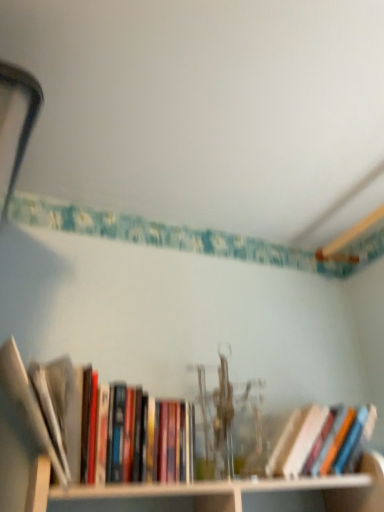
You are a GUI agent. You are given a task and a screenshot of the screen. Output one action in this format:
    pyautogui.click(x=<x>, y=<y>)
    Task: Click on the white wood cabinet at lower center
    
    Given the screenshot: What is the action you would take?
    pyautogui.click(x=235, y=494)

What do you see at coordinates (235, 494) in the screenshot? The height and width of the screenshot is (512, 384). I see `white wood cabinet at lower center` at bounding box center [235, 494].

Measure the distance between hardcover books at left, which ranks as the 1th book in left-to-right order, and camera.

hardcover books at left, which ranks as the 1th book in left-to-right order, is 77.92 centimeters from camera.

At what (x,y) coordinates should I click in order to perform the action: click on hardcover book at center, positioned as the first book in right-to-left order. Please return your answer as a coordinate pair (x, y). Looking at the image, I should click on (308, 439).

Looking at their sizes, would you say hardcover books at left, which ranks as the 1th book in left-to-right order, is wider or thinner than white wood cabinet at lower center?

Considering their sizes, hardcover books at left, which ranks as the 1th book in left-to-right order, looks broader than white wood cabinet at lower center.

Is hardcover books at left, which ranks as the 1th book in left-to-right order, to the left or to the right of white wood cabinet at lower center in the image?

In the image, hardcover books at left, which ranks as the 1th book in left-to-right order, appears on the left side of white wood cabinet at lower center.

Is hardcover books at left, the 2th book from the right, touching white wood cabinet at lower center?

No, hardcover books at left, the 2th book from the right, is not in contact with white wood cabinet at lower center.

Considering the points (115, 464) and (288, 480), which point is in front, point (115, 464) or point (288, 480)?

Positioned in front is point (115, 464).

Is white wood cabinet at lower center completely or partially outside of hardcover books at left, the 2th book from the right?

Absolutely, white wood cabinet at lower center is external to hardcover books at left, the 2th book from the right.

Could you measure the distance between white wood cabinet at lower center and hardcover books at left, the 2th book from the right?

They are 4.55 inches apart.

Is white wood cabinet at lower center closer to the viewer compared to hardcover books at left, the 2th book from the right?

No, it is not.

From a real-world perspective, is white wood cabinet at lower center positioned over hardcover books at left, the 2th book from the right, based on gravity?

No, from a real-world perspective, white wood cabinet at lower center is not above hardcover books at left, the 2th book from the right.

From the picture: Is hardcover book at center, the 2th book positioned from the left, in front of or behind white wood cabinet at lower center in the image?

Clearly, hardcover book at center, the 2th book positioned from the left, is behind white wood cabinet at lower center.

Does hardcover book at center, positioned as the first book in right-to-left order, appear on the left side of white wood cabinet at lower center?

No.

Is hardcover book at center, positioned as the first book in right-to-left order, looking in the opposite direction of white wood cabinet at lower center?

No, hardcover book at center, positioned as the first book in right-to-left order, is not facing the opposite direction of white wood cabinet at lower center.

Based on the photo, between hardcover book at center, the 2th book positioned from the left, and white wood cabinet at lower center, which one has less height?

white wood cabinet at lower center.

How many degrees apart are the facing directions of white wood cabinet at lower center and hardcover book at center, the 2th book positioned from the left?

The angle between the facing direction of white wood cabinet at lower center and the facing direction of hardcover book at center, the 2th book positioned from the left, is 0.822 degrees.

From the picture: Is white wood cabinet at lower center spatially inside hardcover book at center, positioned as the first book in right-to-left order, or outside of it?

white wood cabinet at lower center lies outside hardcover book at center, positioned as the first book in right-to-left order.

Does white wood cabinet at lower center have a smaller size compared to hardcover book at center, positioned as the first book in right-to-left order?

No, white wood cabinet at lower center is not smaller than hardcover book at center, positioned as the first book in right-to-left order.

Is hardcover book at center, positioned as the first book in right-to-left order, inside or outside of hardcover books at left, which ranks as the 1th book in left-to-right order?

hardcover book at center, positioned as the first book in right-to-left order, exists outside the volume of hardcover books at left, which ranks as the 1th book in left-to-right order.

Based on the photo, is hardcover book at center, the 2th book positioned from the left, in front of or behind hardcover books at left, the 2th book from the right, in the image?

Visually, hardcover book at center, the 2th book positioned from the left, is located behind hardcover books at left, the 2th book from the right.

From the image's perspective, between hardcover book at center, the 2th book positioned from the left, and hardcover books at left, which ranks as the 1th book in left-to-right order, who is located below?

hardcover book at center, the 2th book positioned from the left, is shown below in the image.

Can you tell me how much hardcover book at center, the 2th book positioned from the left, and hardcover books at left, the 2th book from the right, differ in facing direction?

0.000753 degrees.

From a real-world perspective, is hardcover books at left, which ranks as the 1th book in left-to-right order, beneath hardcover book at center, the 2th book positioned from the left?

No, from a real-world perspective, hardcover books at left, which ranks as the 1th book in left-to-right order, is not beneath hardcover book at center, the 2th book positioned from the left.

Could you tell me if hardcover books at left, the 2th book from the right, is turned towards hardcover book at center, positioned as the first book in right-to-left order?

No.

Can we say hardcover books at left, which ranks as the 1th book in left-to-right order, lies outside hardcover book at center, the 2th book positioned from the left?

hardcover books at left, which ranks as the 1th book in left-to-right order, is positioned outside hardcover book at center, the 2th book positioned from the left.

Locate an element on the screen. The width and height of the screenshot is (384, 512). book behind the hardcover books at left, the 2th book from the right is located at coordinates (308, 439).

You are a GUI agent. You are given a task and a screenshot of the screen. Output one action in this format:
    pyautogui.click(x=<x>, y=<y>)
    Task: Click on the cabinet located on the right of hardcover books at left, which ranks as the 1th book in left-to-right order
    
    Given the screenshot: What is the action you would take?
    (235, 494)

The image size is (384, 512). I want to click on book that is the 2nd one above the white wood cabinet at lower center (from a real-world perspective), so click(x=140, y=437).

From the image, which object appears to be farther from white wood cabinet at lower center, hardcover book at center, the 2th book positioned from the left, or hardcover books at left, the 2th book from the right?

hardcover book at center, the 2th book positioned from the left, is further to white wood cabinet at lower center.

Looking at the image, which one is located further to white wood cabinet at lower center, hardcover books at left, the 2th book from the right, or hardcover book at center, positioned as the first book in right-to-left order?

hardcover book at center, positioned as the first book in right-to-left order, is further to white wood cabinet at lower center.

Estimate the real-world distances between objects in this image. Which object is further from hardcover book at center, positioned as the first book in right-to-left order, hardcover books at left, the 2th book from the right, or white wood cabinet at lower center?

The object further to hardcover book at center, positioned as the first book in right-to-left order, is hardcover books at left, the 2th book from the right.

Consider the image. Considering their positions, is white wood cabinet at lower center positioned further to hardcover book at center, the 2th book positioned from the left, than hardcover books at left, the 2th book from the right?

hardcover books at left, the 2th book from the right, lies further to hardcover book at center, the 2th book positioned from the left, than the other object.

From the image, which object appears to be nearer to hardcover books at left, which ranks as the 1th book in left-to-right order, white wood cabinet at lower center or hardcover book at center, the 2th book positioned from the left?

white wood cabinet at lower center is closer to hardcover books at left, which ranks as the 1th book in left-to-right order.

Estimate the real-world distances between objects in this image. Which object is closer to hardcover books at left, the 2th book from the right, hardcover book at center, positioned as the first book in right-to-left order, or white wood cabinet at lower center?

white wood cabinet at lower center.

Locate an element on the screen. The width and height of the screenshot is (384, 512). cabinet between hardcover books at left, the 2th book from the right, and hardcover book at center, the 2th book positioned from the left is located at coordinates (235, 494).